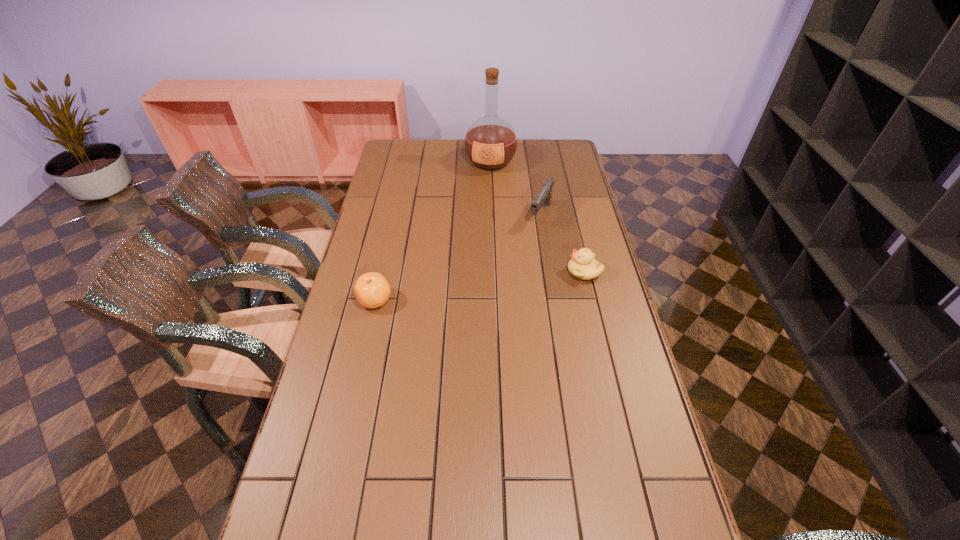
Locate an element on the screen. This screenshot has width=960, height=540. duckling at the right edge is located at coordinates (583, 266).

Where is `gun present at the right edge`? gun present at the right edge is located at coordinates (544, 195).

This screenshot has width=960, height=540. In the image, there is a desktop. Identify the location of vacant region at the far edge. (427, 151).

Identify the location of vacant space at the left edge. (376, 363).

Identify the location of free space at the right edge of the desktop. This screenshot has width=960, height=540. point(585,334).

The image size is (960, 540). I want to click on vacant region at the far left corner of the desktop, so coord(415,161).

Where is `unoccupied area between the third shortest object and the clementine`? unoccupied area between the third shortest object and the clementine is located at coordinates (458, 257).

Locate an element on the screen. empty space that is in between the third object from right to left and the leftmost object is located at coordinates (433, 231).

Where is `free point between the tallest object and the nearest object`? free point between the tallest object and the nearest object is located at coordinates (433, 231).

Find the location of a particular element. This screenshot has width=960, height=540. vacant space in between the nearest object and the second object from left to right is located at coordinates (433, 231).